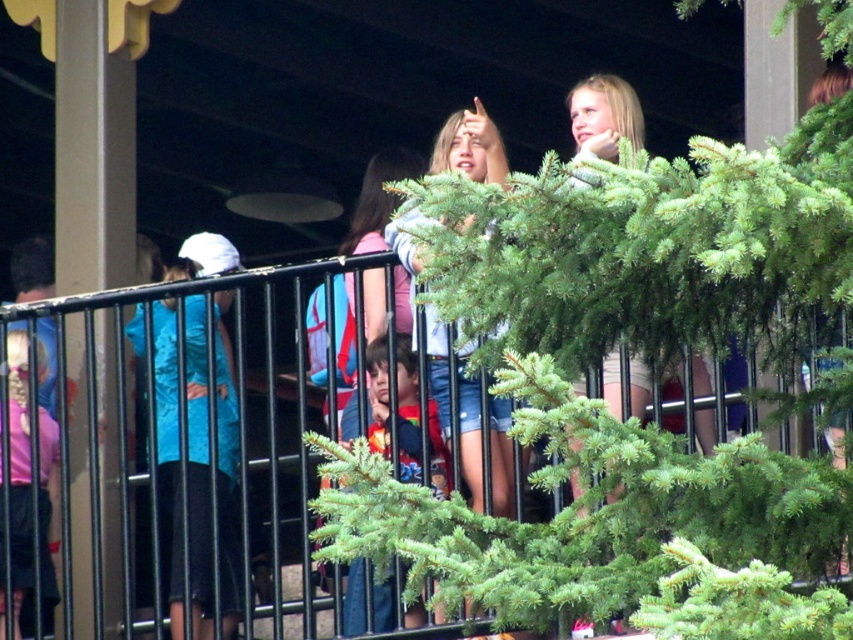
You are at an event and need to find the person wearing the larger blue shirt. Which one should you look for between the blue fabric shirt at left and the matte blue shirt at center?

The matte blue shirt at center is larger than the blue fabric shirt at left, so you should look for the matte blue shirt at center.

You are a painter standing at the lower left corner of the image. You want to paint the black metal fence at upper center but need to know if it is wider than the pink matte shorts at lower left. Can you determine this from your current position?

The black metal fence at upper center might be wider than pink matte shorts at lower left, so it is possible that the fence is wider, but there is uncertainty.